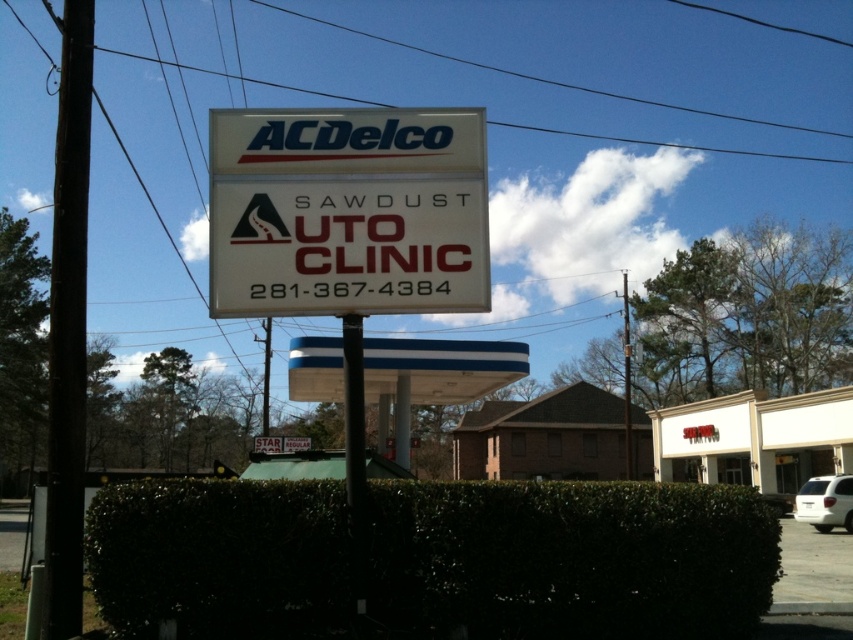
You are a customer looking for the ACDelco Sawdust Auto Clinic. You see the green leafy hedge at center and the white plastic sign at center. Which object is taller and would likely block your view of the signboard?

The green leafy hedge at center is much taller than the white plastic sign at center, so it would likely block your view of the signboard.

What is the significance of the point at coordinates (347, 211) in the image?

The point at coordinates (347, 211) marks the location of the white plastic sign at center.

You are standing in front of the ACDelco Sawdust Auto Clinic signboard. You notice a green leafy hedge at center and a brown brick motel at center. Which object is taller?

The green leafy hedge at center is shorter than the brown brick motel at center, so the brown brick motel at center is taller.